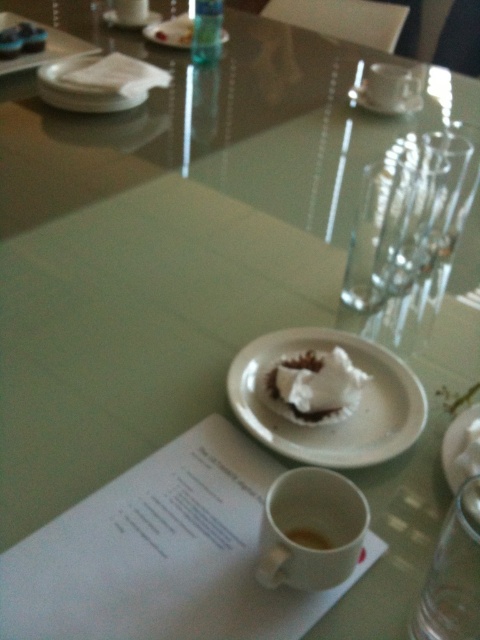
You are a server carrying a tray of dishes. You need to place a dessert on the white matte plate at center and a coffee cup on the white matte saucer at upper center. The distance between them must be exactly 1.5 meters for proper spacing. Can you position them correctly?

The white matte plate at center is 1.52 meters away from the white matte saucer at upper center, so the distance is slightly more than required. You can adjust the placement to reduce the distance by 2 centimeters to meet the 1.5 meters requirement.

You are a server at a restaurant and need to place a dessert on the table. You have a white matte plate at center and a white matte saucer at upper center. Which one should you choose if you want to serve a taller dessert?

You should choose the white matte plate at center because it has a greater height compared to the white matte saucer at upper center, making it suitable for taller desserts.

You are a waiter in a restaurant and need to place a new dessert menu exactly at the coordinate point where the white matte plate at upper center is located. What are the coordinates where you should place the menu?

The white matte plate at upper center is located at coordinates point (170, 32). Therefore, the dessert menu should be placed at point (170, 32).